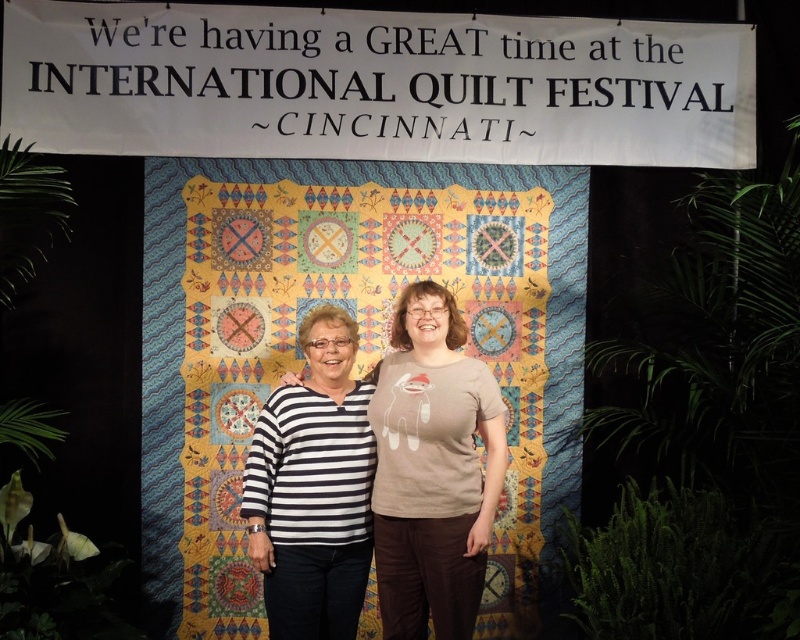
Between point (550, 112) and point (717, 598), which one is positioned behind?

Point (550, 112)

The image size is (800, 640). Identify the location of white paper at upper center. (376, 84).

This screenshot has width=800, height=640. Find the location of `white paper at upper center`. white paper at upper center is located at coordinates (376, 84).

Is point (202, 109) positioned behind point (262, 465)?

Yes, point (202, 109) is farther from viewer.

Does white paper at upper center have a smaller size compared to black and white striped shirt at center?

No.

Which is behind, point (724, 80) or point (326, 522)?

Positioned behind is point (724, 80).

This screenshot has width=800, height=640. What are the coordinates of `white paper at upper center` in the screenshot? It's located at (376, 84).

Who is more forward, (x=576, y=36) or (x=472, y=461)?

Point (x=472, y=461) is more forward.

Between white paper at upper center and matte beige t-shirt at center, which one appears on the right side from the viewer's perspective?

Positioned to the right is matte beige t-shirt at center.

Identify the location of white paper at upper center. The width and height of the screenshot is (800, 640). pos(376,84).